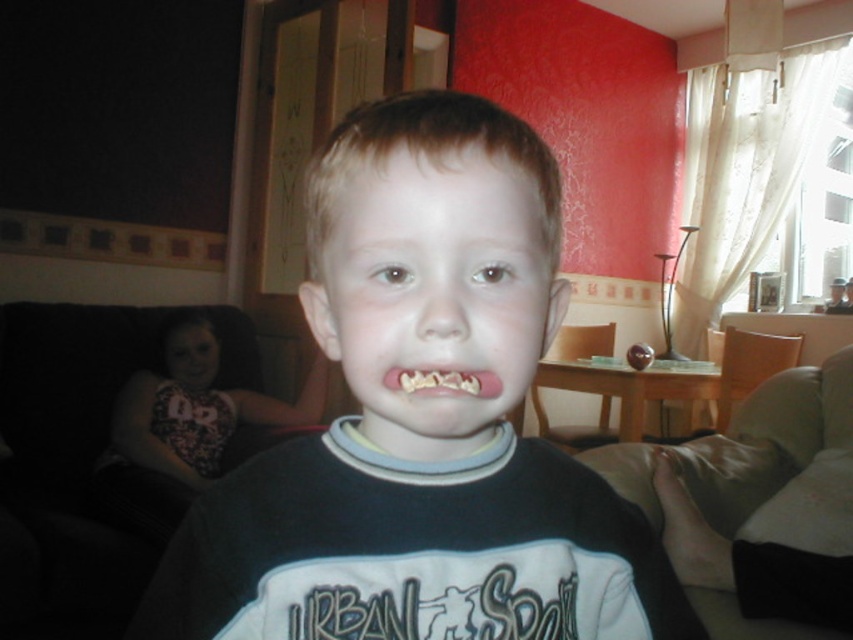
Question: Can you confirm if black cotton shirt at center is positioned below dark pink fabric at left?

Choices:
 (A) yes
 (B) no

Answer: (B)

Question: Does dark pink fabric at left appear on the left side of pink rubber mouth at center?

Choices:
 (A) no
 (B) yes

Answer: (B)

Question: Which object is positioned closest to the dark pink fabric at left?

Choices:
 (A) black cotton shirt at center
 (B) pink rubber mouth at center

Answer: (A)

Question: Can you confirm if dark pink fabric at left is positioned to the right of pink rubber mouth at center?

Choices:
 (A) yes
 (B) no

Answer: (B)

Question: Estimate the real-world distances between objects in this image. Which object is farther from the dark pink fabric at left?

Choices:
 (A) pink rubber mouth at center
 (B) black cotton shirt at center

Answer: (A)

Question: Which point is farther from the camera taking this photo?

Choices:
 (A) (399, 381)
 (B) (386, 294)
 (C) (165, 364)

Answer: (C)